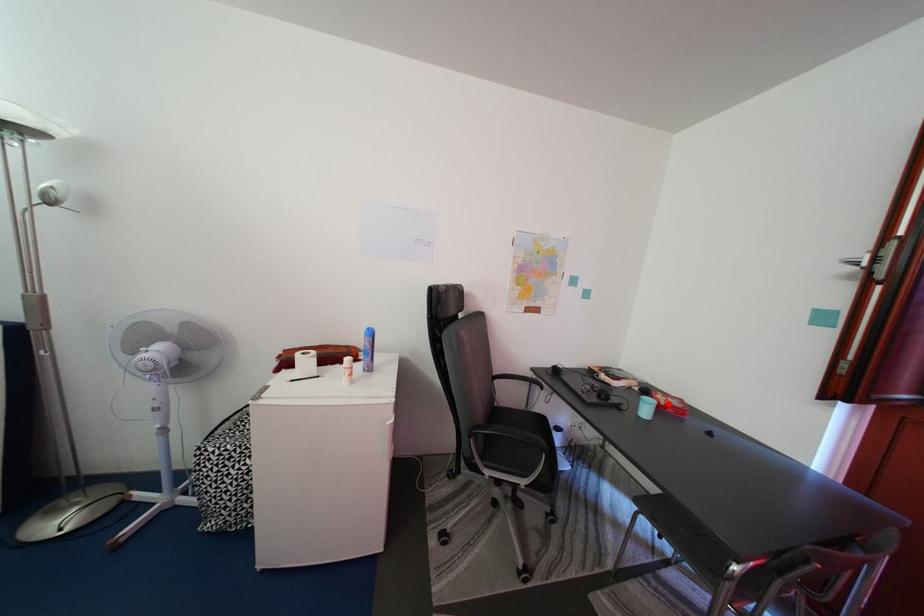
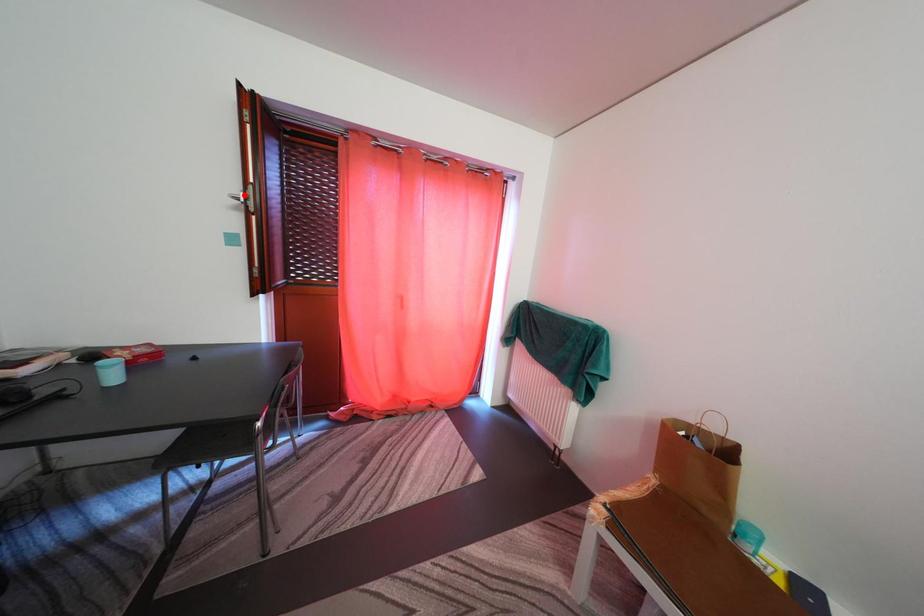
I am providing you with two images of the same scene from different viewpoints. A red point is marked on the first image and another point is marked on the second image. Does the point marked in image1 correspond to the same location as the one in image2?

No